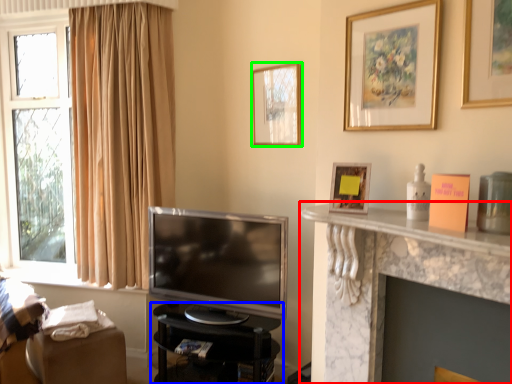
Question: Which is nearer to the shelf (highlighted by a red box)? furniture (highlighted by a blue box) or picture frame (highlighted by a green box).

Choices:
 (A) furniture
 (B) picture frame

Answer: (A)